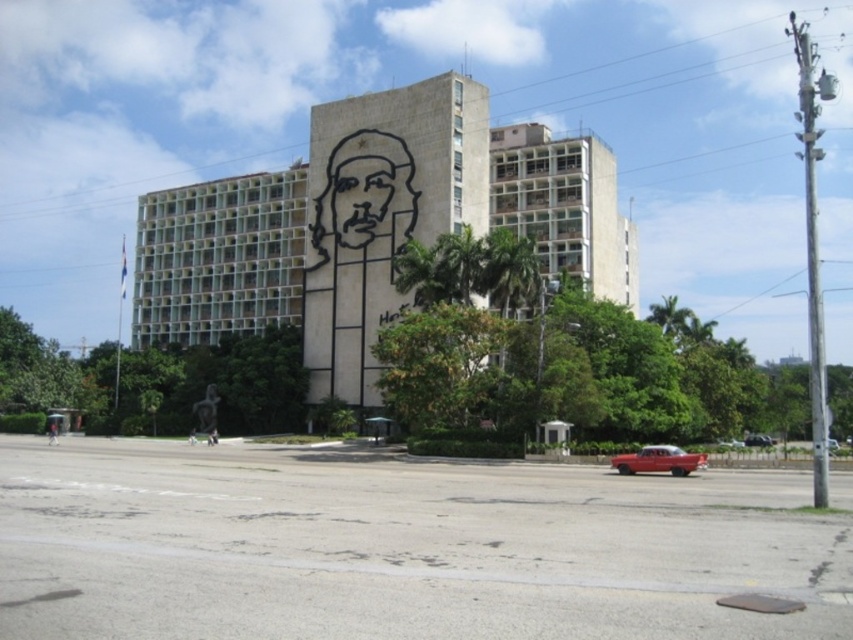
You are a parking attendant and need to fit both the metallic red car at center and the shiny red car at lower right into a parking spot that is 2 meters wide. Can both cars fit side by side in the spot without overlapping?

The metallic red car at center is wider than the shiny red car at lower right. Since the parking spot is only 2 meters wide, and the combined width of both cars exceeds this, they cannot fit side by side without overlapping.

You are a photographer trying to capture both the shiny red car at lower center and the metallic red car at center in a single frame. Which car should you position closer to the camera to ensure both are fully visible without cropping?

To ensure both the shiny red car at lower center and the metallic red car at center are fully visible, you should position the shiny red car at lower center closer to the camera since it is thinner than the metallic red car at center, allowing it to take up less space in the frame while still including the wider metallic red car at center.

You are a photographer trying to capture both the metallic red car at center and the shiny red car at lower right in a single shot. Since you want to include the entire building facade with the mural in the background, which car should you position closer to the camera to ensure it doesn t get cropped out?

The metallic red car at center is taller than the shiny red car at lower right. To ensure the entire building facade with the mural is captured without cropping, position the metallic red car at center closer to the camera. This way, its greater height will help frame the shot vertically, allowing the mural and building to be fully visible while still including both cars.